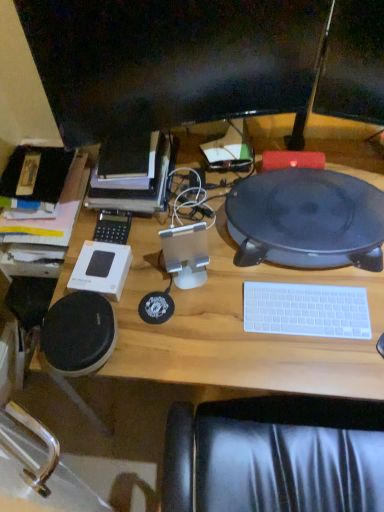
Question: From the image's perspective, relative to matte black tablet at center, is white plastic keyboard at lower right above or below?

Choices:
 (A) above
 (B) below

Answer: (B)

Question: From a real-world perspective, is white plastic keyboard at lower right above or below matte black tablet at center?

Choices:
 (A) above
 (B) below

Answer: (B)

Question: Estimate the real-world distances between objects in this image. Which object is farther from the white plastic keyboard at lower right?

Choices:
 (A) hardcover book at upper left
 (B) matte black tablet at center
 (C) black glossy monitor at upper center
 (D) black plastic calculator at center-left

Answer: (C)

Question: Estimate the real-world distances between objects in this image. Which object is closer to the matte black tablet at center?

Choices:
 (A) black plastic calculator at center-left
 (B) black glossy monitor at upper center
 (C) white plastic keyboard at lower right
 (D) hardcover book at upper left

Answer: (C)